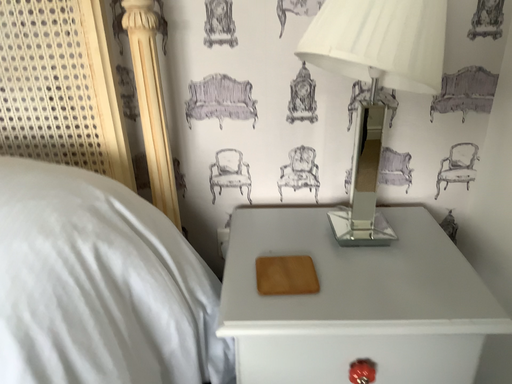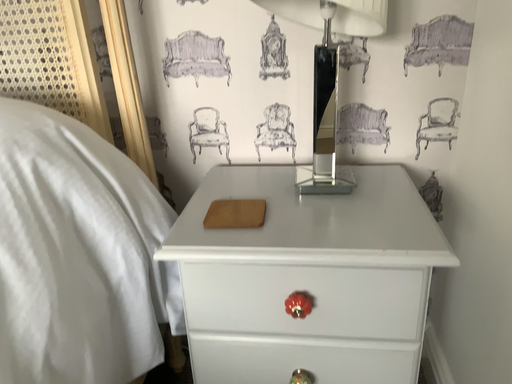
Question: How did the camera likely rotate when shooting the video?

Choices:
 (A) rotated left
 (B) rotated right

Answer: (A)